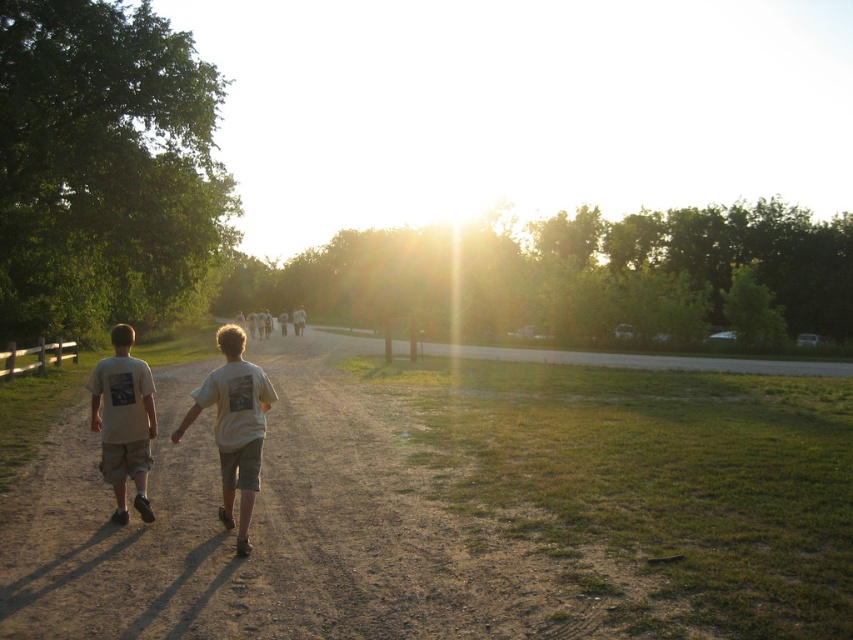
You are standing at the point with coordinates (123, 420) in the image. What object are you currently standing on?

You are standing on the white cotton t shirt at left.